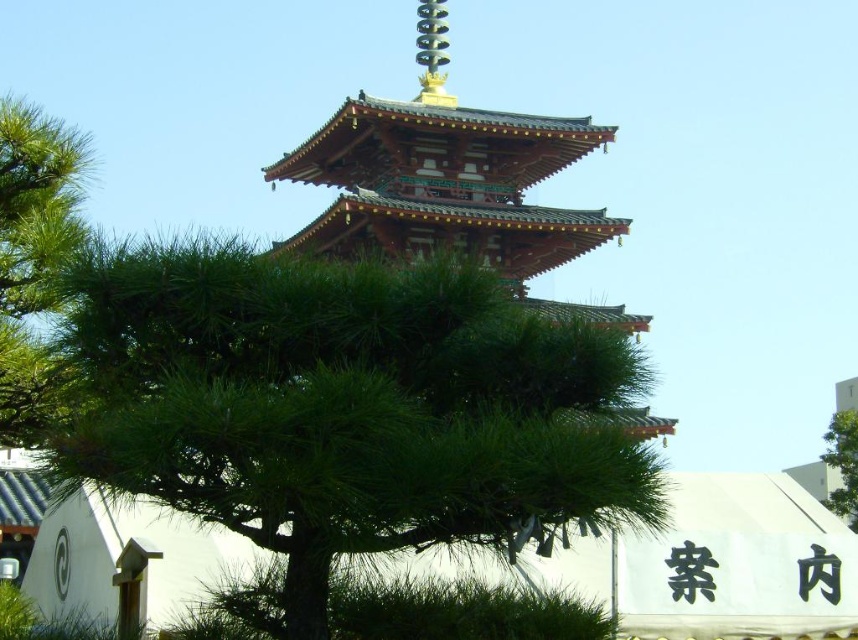
Question: Can you confirm if green matte tree at center is positioned above green leafy tree at upper right?

Choices:
 (A) no
 (B) yes

Answer: (B)

Question: Which point is farther to the camera?

Choices:
 (A) green needle-like leaves at left
 (B) green matte tree at center
 (C) green leafy tree at upper right

Answer: (C)

Question: Which point is closer to the camera?

Choices:
 (A) green leafy tree at upper right
 (B) green matte tree at center
 (C) green needle-like leaves at left

Answer: (B)

Question: Does green matte tree at center lie in front of green leafy tree at upper right?

Choices:
 (A) no
 (B) yes

Answer: (B)

Question: Which object appears farthest from the camera in this image?

Choices:
 (A) green needle-like leaves at left
 (B) green matte tree at center

Answer: (A)

Question: Is green matte tree at center to the left of green leafy tree at upper right from the viewer's perspective?

Choices:
 (A) yes
 (B) no

Answer: (A)